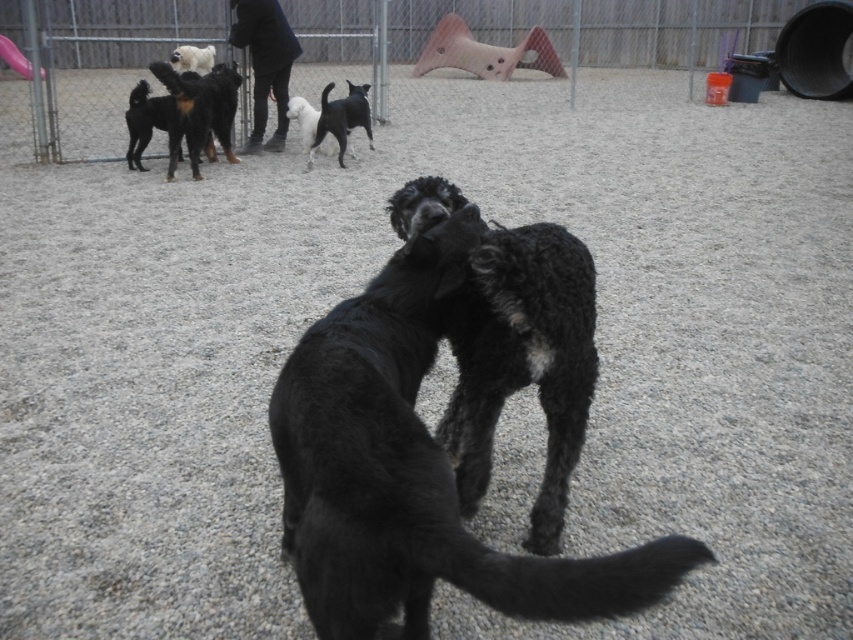
You are a drone operator trying to capture a photo of the shaggy black dog at center from above. The drone must stay at least 10 meters away from the metal fence at upper center to avoid crashing. Can you safely take the photo without getting too close to the fence?

The distance between the metal fence at upper center and the shaggy black dog at center is 11.36 meters, which is more than the required 10 meters. Therefore, you can safely take the photo without getting too close to the fence.

You are a dog owner trying to identify your two dogs in the image. Your first dog is the black curly fur dog at center, and the second is the black matte dog at upper center. Which of your dogs is taller?

The black matte dog at upper center is taller than the black curly fur dog at center.